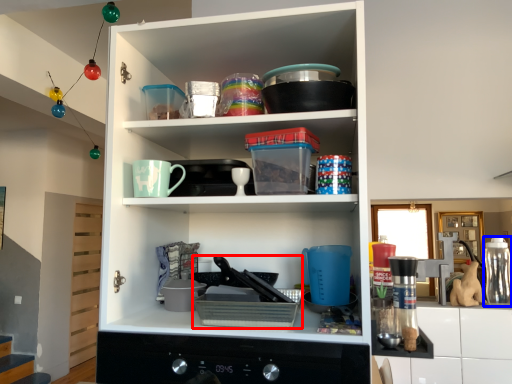
Question: Which object appears farthest to the camera in this image, appliance (highlighted by a red box) or bottle (highlighted by a blue box)?

Choices:
 (A) appliance
 (B) bottle

Answer: (B)